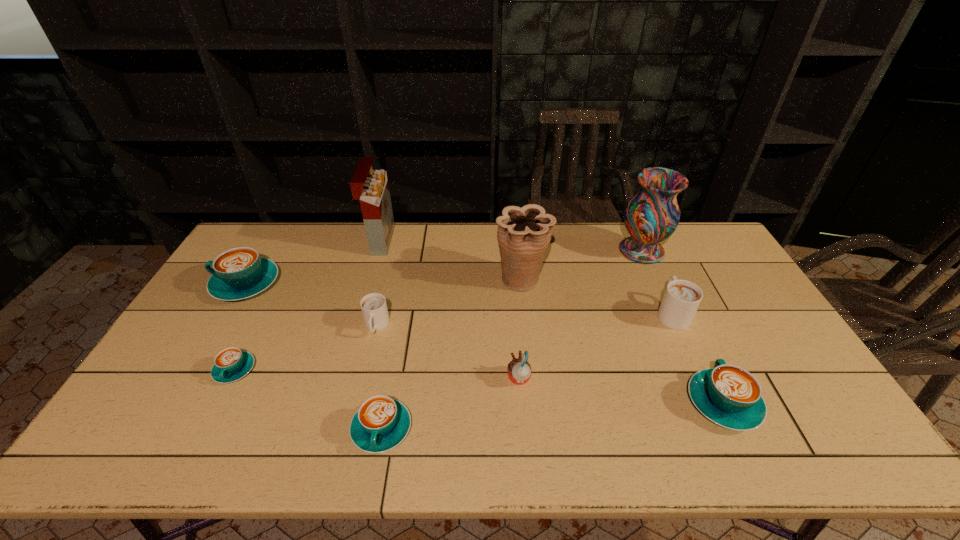
Where is `vacant space at the left edge of the desktop`? vacant space at the left edge of the desktop is located at coordinates (211, 308).

At what (x,y) coordinates should I click in order to perform the action: click on blank area at the right edge. Please return your answer as a coordinate pair (x, y). Looking at the image, I should click on (743, 289).

Find the location of a particular element. The height and width of the screenshot is (540, 960). free space at the near left corner of the desktop is located at coordinates (146, 439).

Locate an element on the screen. The width and height of the screenshot is (960, 540). free space at the near right corner is located at coordinates (790, 428).

I want to click on free spot between the smallest turquoise cappuccino and the fifth tallest cappuccino, so click(308, 399).

Locate an element on the screen. The image size is (960, 540). vacant space in between the biggest turquoise cappuccino and the second smallest turquoise cappuccino is located at coordinates (314, 356).

Where is `free point between the vase and the right white cappuccino`? free point between the vase and the right white cappuccino is located at coordinates (657, 282).

I want to click on vacant area that lies between the third turquoise cappuccino from left to right and the shortest object, so click(308, 399).

Locate an element on the screen. The image size is (960, 540). free space between the muffin and the rightmost turquoise cappuccino is located at coordinates (621, 390).

This screenshot has height=540, width=960. Find the location of `vacant space in between the red cigarette case and the second biggest turquoise cappuccino`. vacant space in between the red cigarette case and the second biggest turquoise cappuccino is located at coordinates (552, 322).